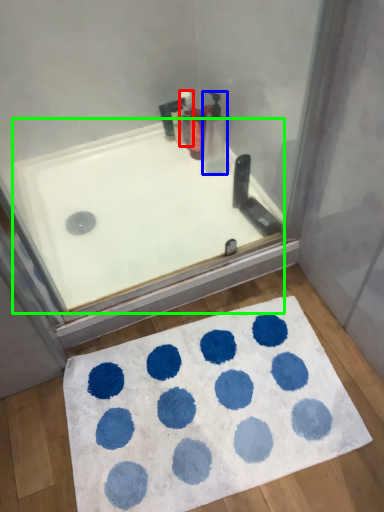
Question: Considering the real-world distances, which object is closest to cleaning product (highlighted by a red box)? cleaning product (highlighted by a blue box) or bathtub (highlighted by a green box).

Choices:
 (A) cleaning product
 (B) bathtub

Answer: (A)